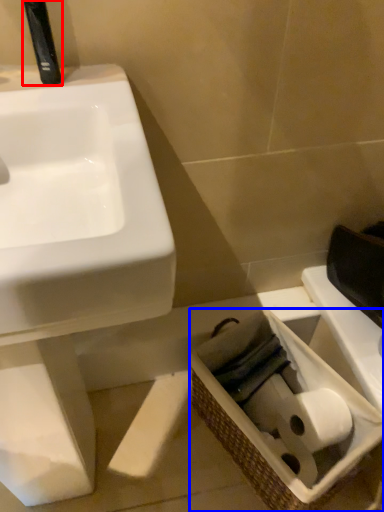
Question: Which of the following is the closest to the observer, plumbing fixture (highlighted by a red box) or basket (highlighted by a blue box)?

Choices:
 (A) plumbing fixture
 (B) basket

Answer: (A)